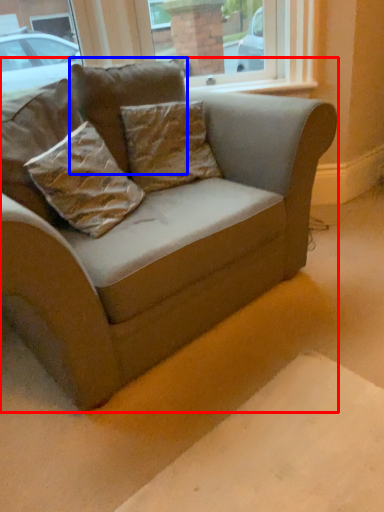
Question: Among these objects, which one is farthest to the camera, studio couch (highlighted by a red box) or pillow (highlighted by a blue box)?

Choices:
 (A) studio couch
 (B) pillow

Answer: (B)